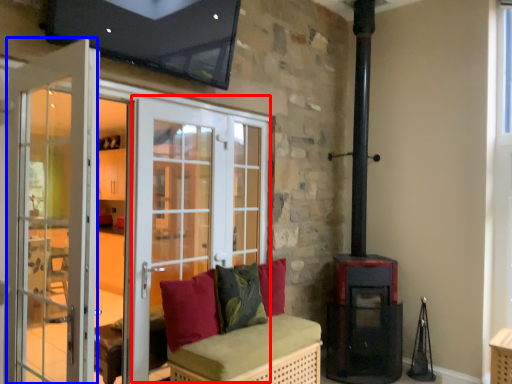
Question: Among these objects, which one is farthest to the camera, screen door (highlighted by a red box) or screen door (highlighted by a blue box)?

Choices:
 (A) screen door
 (B) screen door

Answer: (A)